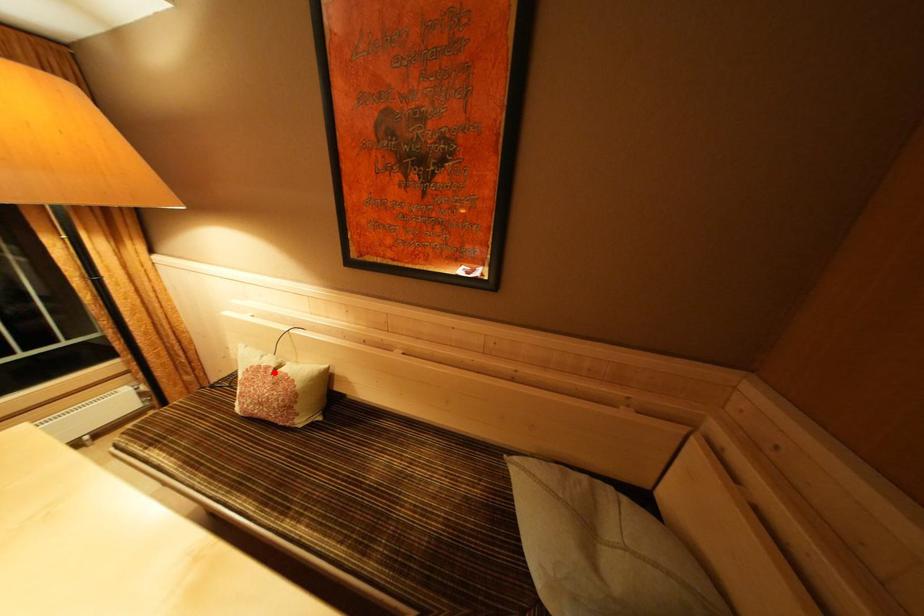
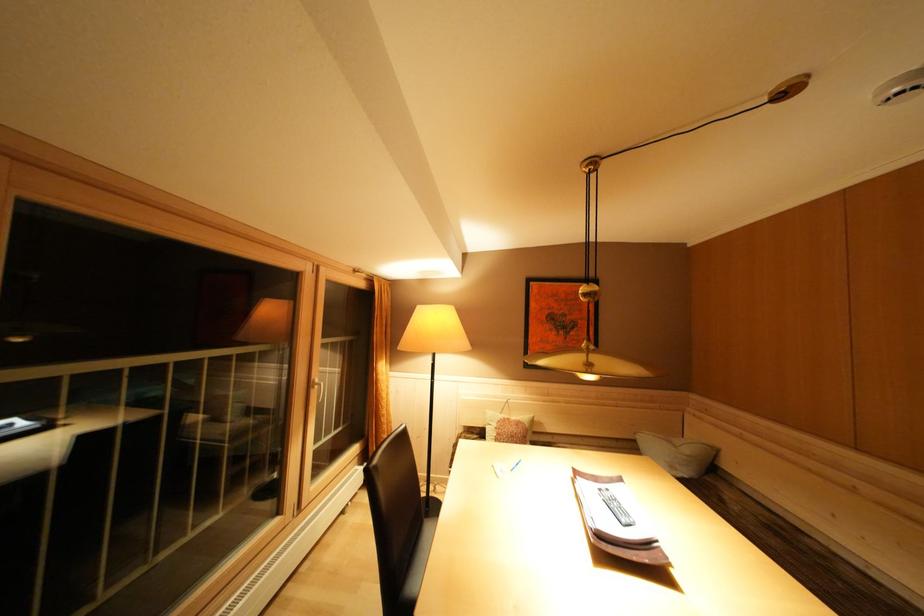
Question: I am providing you with two images of the same scene from different viewpoints. Given a red point in image1, look at the same physical point in image2. Is it:

Choices:
 (A) Closer to the viewpoint
 (B) Farther from the viewpoint

Answer: (B)